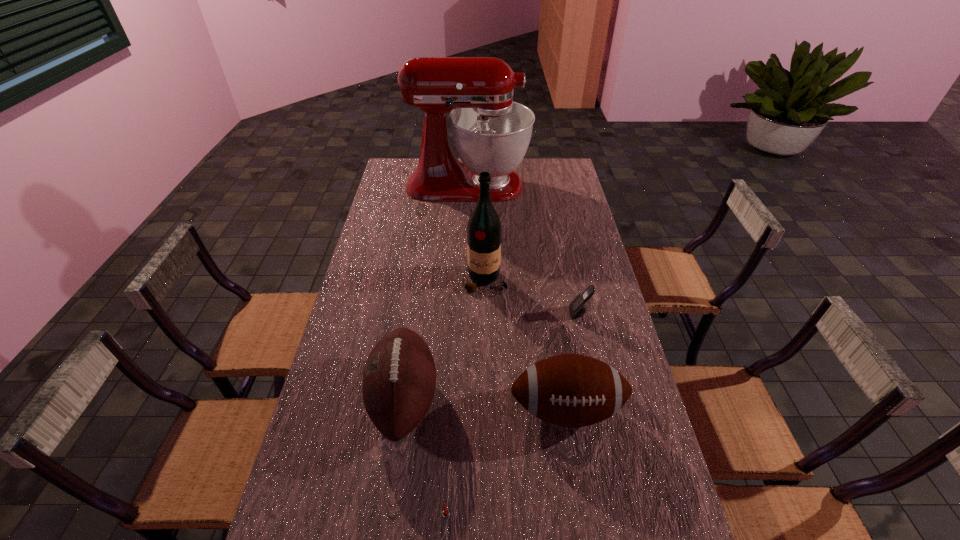
The width and height of the screenshot is (960, 540). Find the location of `object situated at the far left corner`. object situated at the far left corner is located at coordinates (491, 133).

Where is `vacant position at the left edge of the desktop`? The height and width of the screenshot is (540, 960). vacant position at the left edge of the desktop is located at coordinates (394, 205).

At what (x,y) coordinates should I click in order to perform the action: click on vacant space at the right edge. Please return your answer as a coordinate pair (x, y). The width and height of the screenshot is (960, 540). Looking at the image, I should click on (653, 535).

Locate an element on the screen. vacant space at the far left corner is located at coordinates (403, 183).

Locate an element on the screen. vacant space at the far right corner of the desktop is located at coordinates (562, 166).

You are a GUI agent. You are given a task and a screenshot of the screen. Output one action in this format:
    pyautogui.click(x=<x>, y=<y>)
    Task: Click on the free spot between the farthest object and the left football
    The height and width of the screenshot is (540, 960).
    Given the screenshot: What is the action you would take?
    pyautogui.click(x=436, y=292)

Find the location of a particular element. This screenshot has width=960, height=540. free space between the second farthest object and the right football is located at coordinates (526, 345).

Identify the location of vacant area between the fourth nearest object and the farthest object. (523, 249).

Find the location of a particular element. unoccupied position between the wine bottle and the left football is located at coordinates (445, 340).

I want to click on free space between the second tallest object and the left football, so click(x=445, y=340).